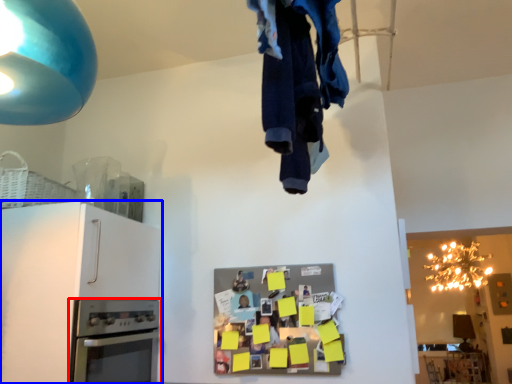
Question: Which object is further to the camera taking this photo, home appliance (highlighted by a red box) or cabinetry (highlighted by a blue box)?

Choices:
 (A) home appliance
 (B) cabinetry

Answer: (A)